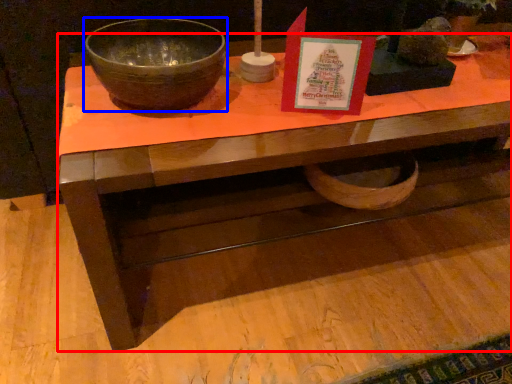
Question: Which object appears closest to the camera in this image, desk (highlighted by a red box) or bowl (highlighted by a blue box)?

Choices:
 (A) desk
 (B) bowl

Answer: (A)